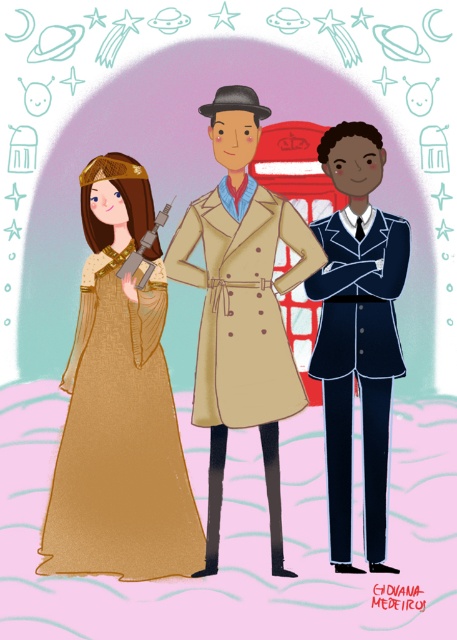
You are an alien observer analyzing the image. The matte gold dress at center and metallic gun at left are two objects in the scene. Which object takes up more space visually?

The matte gold dress at center is larger in size compared to the metallic gun at left, so it takes up more visual space.